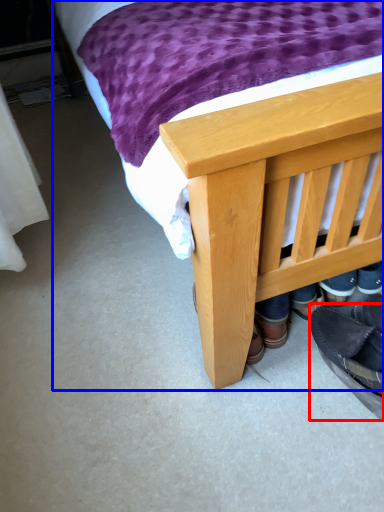
Question: Which object is closer to the camera taking this photo, footwear (highlighted by a red box) or bed (highlighted by a blue box)?

Choices:
 (A) footwear
 (B) bed

Answer: (B)